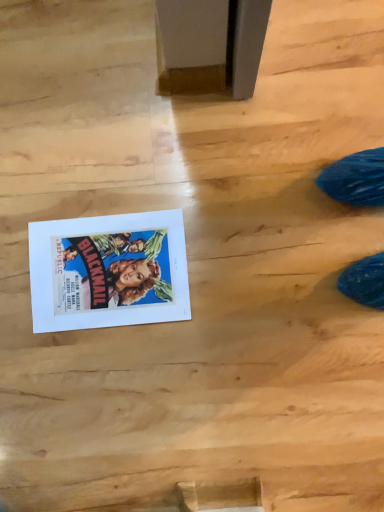
Question: From the image's perspective, is matte paper poster at lower left positioned above or below wooden plank at lower center?

Choices:
 (A) below
 (B) above

Answer: (B)

Question: Considering the positions of matte paper poster at lower left and wooden plank at lower center in the image, is matte paper poster at lower left taller or shorter than wooden plank at lower center?

Choices:
 (A) short
 (B) tall

Answer: (A)

Question: Considering their positions, is matte paper poster at lower left located in front of or behind wooden plank at lower center?

Choices:
 (A) front
 (B) behind

Answer: (B)

Question: From their relative heights in the image, would you say wooden plank at lower center is taller or shorter than matte paper poster at lower left?

Choices:
 (A) short
 (B) tall

Answer: (B)

Question: Is wooden plank at lower center in front of or behind matte paper poster at lower left in the image?

Choices:
 (A) front
 (B) behind

Answer: (A)

Question: In terms of width, does wooden plank at lower center look wider or thinner when compared to matte paper poster at lower left?

Choices:
 (A) wide
 (B) thin

Answer: (B)

Question: From the image's perspective, is wooden plank at lower center above or below matte paper poster at lower left?

Choices:
 (A) below
 (B) above

Answer: (A)